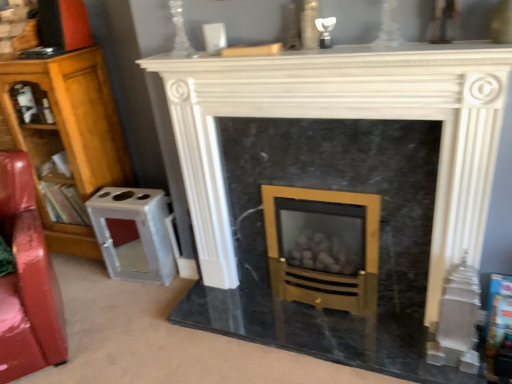
This screenshot has height=384, width=512. What are the coordinates of `glossy red swivel chair at left` in the screenshot? It's located at (27, 279).

Where is `glossy red swivel chair at left`? The width and height of the screenshot is (512, 384). glossy red swivel chair at left is located at coordinates [x=27, y=279].

Who is taller, wooden bookcase at left or glossy red swivel chair at left?

With more height is wooden bookcase at left.

Locate an element on the screen. This screenshot has height=384, width=512. swivel chair in front of the wooden bookcase at left is located at coordinates (27, 279).

Is wooden bookcase at left outside of glossy red swivel chair at left?

Absolutely, wooden bookcase at left is external to glossy red swivel chair at left.

Does wooden bookcase at left turn towards glossy red swivel chair at left?

Yes, wooden bookcase at left is oriented towards glossy red swivel chair at left.

Does point (32, 251) lie in front of point (33, 88)?

That is True.

Considering the sizes of objects glossy red swivel chair at left and wooden bookcase at left in the image provided, who is shorter, glossy red swivel chair at left or wooden bookcase at left?

glossy red swivel chair at left is shorter.

From a real-world perspective, is glossy red swivel chair at left over wooden bookcase at left?

No.

Is glossy red swivel chair at left facing towards wooden bookcase at left?

No, glossy red swivel chair at left is not aimed at wooden bookcase at left.

Could you tell me if white marble fireplace at center is turned towards wooden bookcase at left?

No, white marble fireplace at center is not aimed at wooden bookcase at left.

From a real-world perspective, is white marble fireplace at center over wooden bookcase at left?

Actually, white marble fireplace at center is physically below wooden bookcase at left in the real world.

At what (x,y) coordinates should I click in order to perform the action: click on fireplace below the wooden bookcase at left (from the image's perspective). Please return your answer as a coordinate pair (x, y). The height and width of the screenshot is (384, 512). Looking at the image, I should click on (347, 118).

From the image's perspective, is glossy red swivel chair at left located above white marble fireplace at center?

Actually, glossy red swivel chair at left appears below white marble fireplace at center in the image.

Is glossy red swivel chair at left thinner than white marble fireplace at center?

Incorrect, the width of glossy red swivel chair at left is not less than that of white marble fireplace at center.

Is glossy red swivel chair at left in contact with white marble fireplace at center?

No, glossy red swivel chair at left is not beside white marble fireplace at center.

Is white marble fireplace at center not close to glossy red swivel chair at left?

No, white marble fireplace at center is not far from glossy red swivel chair at left.

Is white marble fireplace at center inside or outside of glossy red swivel chair at left?

white marble fireplace at center exists outside the volume of glossy red swivel chair at left.

From the image's perspective, which one is positioned higher, white marble fireplace at center or glossy red swivel chair at left?

white marble fireplace at center, from the image's perspective.

Locate an element on the screen. This screenshot has width=512, height=384. fireplace that appears below the wooden bookcase at left (from a real-world perspective) is located at coordinates (347, 118).

Based on the photo, which object is wider, wooden bookcase at left or white marble fireplace at center?

With larger width is wooden bookcase at left.

Is wooden bookcase at left positioned with its back to white marble fireplace at center?

wooden bookcase at left is not turned away from white marble fireplace at center.

Does wooden bookcase at left have a larger size compared to white marble fireplace at center?

Yes.

Locate an element on the screen. bookcase above the glossy red swivel chair at left (from the image's perspective) is located at coordinates (69, 139).

Locate an element on the screen. This screenshot has height=384, width=512. bookcase that appears above the glossy red swivel chair at left (from a real-world perspective) is located at coordinates (69, 139).

Considering their positions, is white marble fireplace at center positioned further to glossy red swivel chair at left than wooden bookcase at left?

white marble fireplace at center lies further to glossy red swivel chair at left than the other object.

Based on their spatial positions, is glossy red swivel chair at left or wooden bookcase at left closer to white marble fireplace at center?

glossy red swivel chair at left is closer to white marble fireplace at center.

From the picture: Looking at the image, which one is located closer to wooden bookcase at left, white marble fireplace at center or glossy red swivel chair at left?

glossy red swivel chair at left is closer to wooden bookcase at left.

Which object lies further to the anchor point wooden bookcase at left, glossy red swivel chair at left or white marble fireplace at center?

The object further to wooden bookcase at left is white marble fireplace at center.

Estimate the real-world distances between objects in this image. Which object is further from white marble fireplace at center, wooden bookcase at left or glossy red swivel chair at left?

Among the two, wooden bookcase at left is located further to white marble fireplace at center.

When comparing their distances from glossy red swivel chair at left, does wooden bookcase at left or white marble fireplace at center seem closer?

wooden bookcase at left is positioned closer to the anchor glossy red swivel chair at left.

Identify the location of swivel chair between wooden bookcase at left and white marble fireplace at center in the horizontal direction. (27, 279).